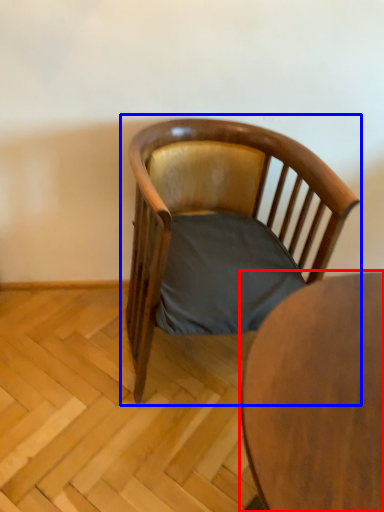
Question: Which object is closer to the camera taking this photo, table (highlighted by a red box) or chair (highlighted by a blue box)?

Choices:
 (A) table
 (B) chair

Answer: (A)